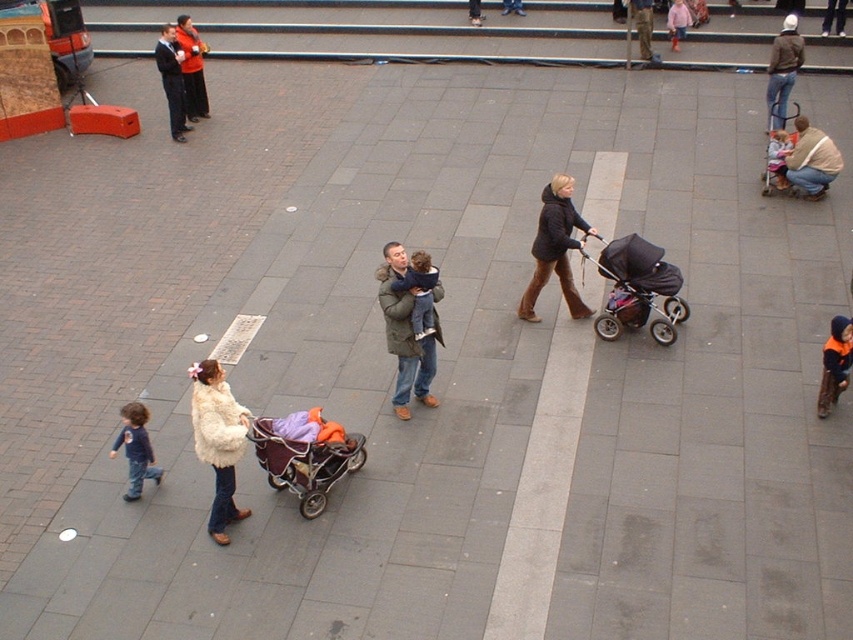
What do you see at coordinates (405, 333) in the screenshot? This screenshot has width=853, height=640. I see `matte green coat at center` at bounding box center [405, 333].

Between point (397, 276) and point (773, 42), which one is positioned behind?

The point (773, 42) is more distant.

In order to click on matte green coat at center in this screenshot , I will do `click(405, 333)`.

Is brown leather jacket at lower right to the right of soft blue sweater at center from the viewer's perspective?

Correct, you'll find brown leather jacket at lower right to the right of soft blue sweater at center.

This screenshot has height=640, width=853. Describe the element at coordinates (811, 160) in the screenshot. I see `brown leather jacket at lower right` at that location.

Locate an element on the screen. brown leather jacket at lower right is located at coordinates (811, 160).

Is soft blue sweater at center to the right of red sweater at upper left from the viewer's perspective?

Indeed, soft blue sweater at center is positioned on the right side of red sweater at upper left.

Is point (412, 321) behind point (183, 44)?

No, (412, 321) is in front of (183, 44).

I want to click on soft blue sweater at center, so click(x=419, y=292).